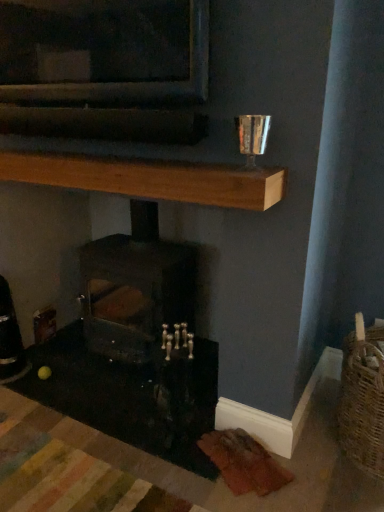
At what (x,y) coordinates should I click in order to perform the action: click on free region under wooden plank at upper center (from a real-world perspective). Please return your answer as a coordinate pair (x, y). Looking at the image, I should click on (88, 392).